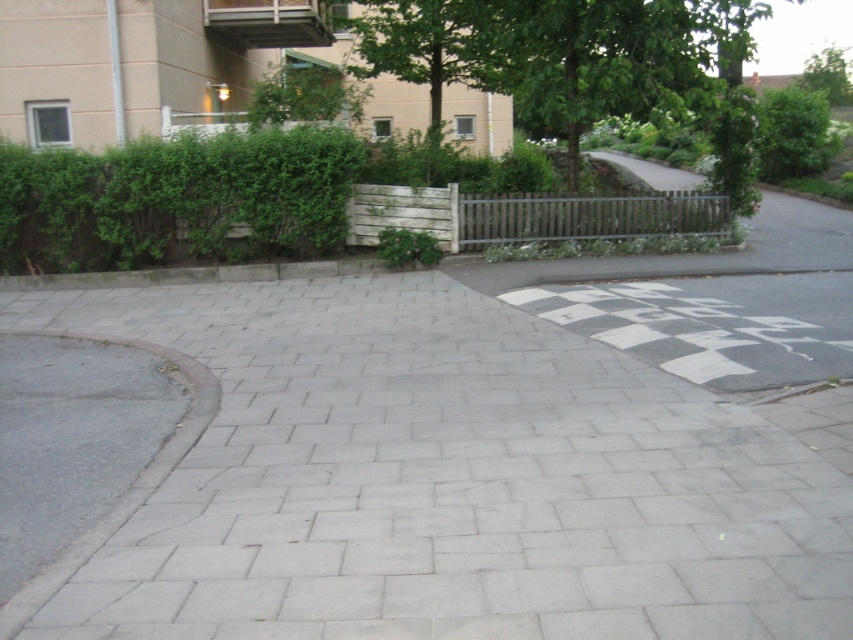
Where is `gray concrete pavement at center`? Image resolution: width=853 pixels, height=640 pixels. gray concrete pavement at center is located at coordinates (450, 480).

Can you confirm if gray concrete pavement at center is wider than green leafy tree at upper right?

No, gray concrete pavement at center is not wider than green leafy tree at upper right.

Who is more forward, (466, 296) or (831, 104)?

Point (466, 296)

I want to click on gray concrete pavement at center, so click(450, 480).

Does green leafy hedge at left appear on the left side of green leafy tree at upper right?

Correct, you'll find green leafy hedge at left to the left of green leafy tree at upper right.

Does point (300, 134) come in front of point (846, 88)?

Yes.

Describe the element at coordinates (175, 198) in the screenshot. I see `green leafy hedge at left` at that location.

This screenshot has width=853, height=640. Identify the location of green leafy hedge at left. (175, 198).

Does gray concrete pavement at center lie in front of green leafy hedge at left?

Yes, gray concrete pavement at center is closer to the viewer.

Does point (241, 369) come closer to viewer compared to point (283, 243)?

Yes.

This screenshot has width=853, height=640. I want to click on gray concrete pavement at center, so click(450, 480).